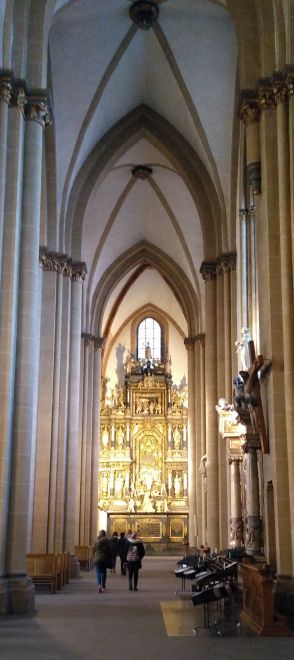
Find the location of `white wall`. white wall is located at coordinates (228, 92).